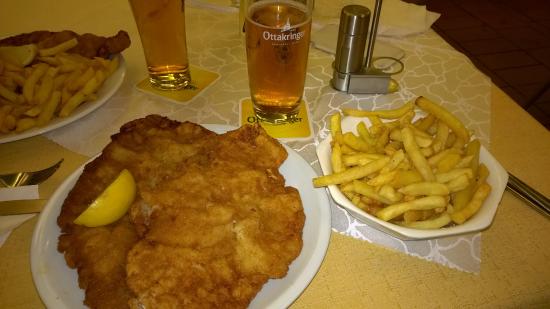
Find the location of a particular element. This screenshot has width=550, height=309. napkins is located at coordinates (29, 191), (403, 15), (330, 38).